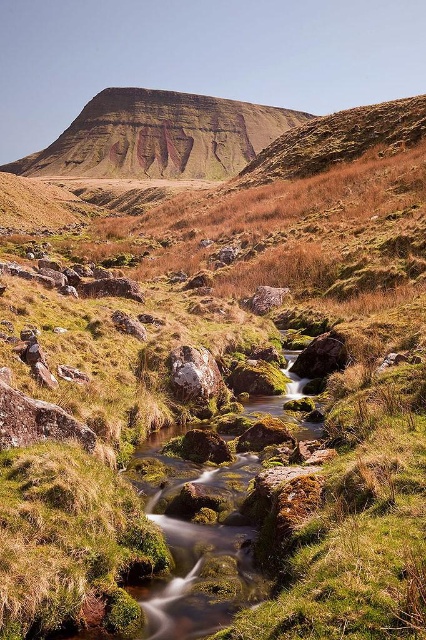
You are standing at the edge of the stream and see the rusty metallic rock at center and the smooth gray rock at center. Which one is positioned lower in the scene?

The rusty metallic rock at center is located below the smooth gray rock at center, so it is positioned lower in the scene.